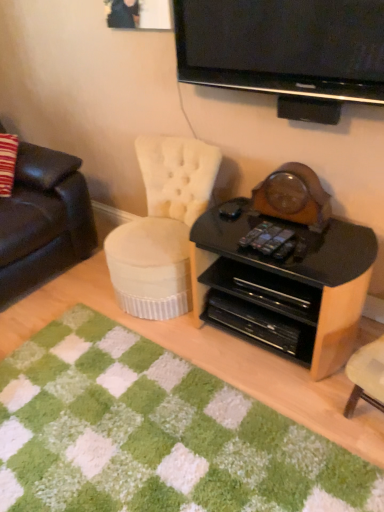
Question: Can you confirm if white tufted fabric chair at center is positioned to the right of black glossy desk at center?

Choices:
 (A) no
 (B) yes

Answer: (A)

Question: Can you confirm if white tufted fabric chair at center is taller than black glossy desk at center?

Choices:
 (A) no
 (B) yes

Answer: (B)

Question: From the image's perspective, is white tufted fabric chair at center beneath black glossy desk at center?

Choices:
 (A) no
 (B) yes

Answer: (A)

Question: Is white tufted fabric chair at center far from black glossy desk at center?

Choices:
 (A) yes
 (B) no

Answer: (B)

Question: Is white tufted fabric chair at center next to black glossy desk at center and touching it?

Choices:
 (A) no
 (B) yes

Answer: (A)

Question: Does white tufted fabric chair at center have a lesser width compared to black glossy desk at center?

Choices:
 (A) yes
 (B) no

Answer: (B)

Question: Can you confirm if black plastic remote control at center is bigger than leather couch at left?

Choices:
 (A) yes
 (B) no

Answer: (B)

Question: Is black plastic remote control at center oriented towards leather couch at left?

Choices:
 (A) yes
 (B) no

Answer: (B)

Question: Does black plastic remote control at center appear on the right side of leather couch at left?

Choices:
 (A) no
 (B) yes

Answer: (B)

Question: Can you confirm if black plastic remote control at center is taller than leather couch at left?

Choices:
 (A) no
 (B) yes

Answer: (A)

Question: Considering the relative positions of black plastic remote control at center and leather couch at left in the image provided, is black plastic remote control at center in front of leather couch at left?

Choices:
 (A) no
 (B) yes

Answer: (B)

Question: Is black plastic remote control at center beside leather couch at left?

Choices:
 (A) yes
 (B) no

Answer: (B)

Question: Is black plastic remote control at center smaller than green shaggy rug at lower center?

Choices:
 (A) yes
 (B) no

Answer: (A)